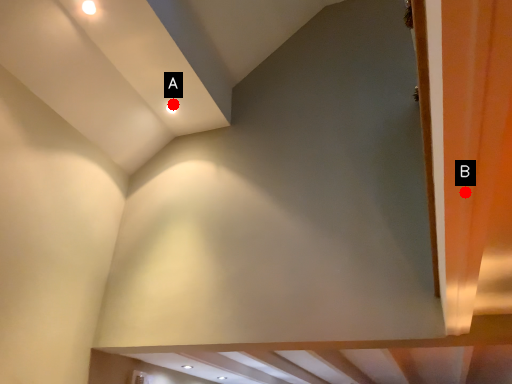
Question: Two points are circled on the image, labeled by A and B beside each circle. Which point is farther from the camera taking this photo?

Choices:
 (A) A is further
 (B) B is further

Answer: (A)